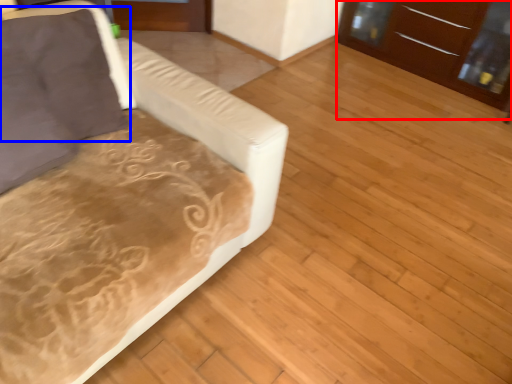
Question: Which object appears farthest to the camera in this image, dresser (highlighted by a red box) or pillow (highlighted by a blue box)?

Choices:
 (A) dresser
 (B) pillow

Answer: (A)